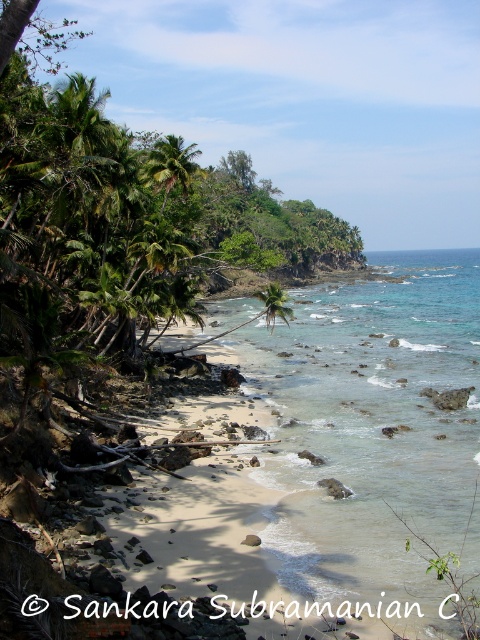
Is green leafy palm tree at upper left in front of green leafy palm tree at center?

Yes, green leafy palm tree at upper left is closer to the viewer.

Between point (168, 179) and point (267, 326), which one is positioned behind?

Point (267, 326)

I want to click on green leafy palm tree at upper left, so click(x=170, y=164).

Between clear water at beach center and green leafy palm tree at upper left, which one appears on the right side from the viewer's perspective?

clear water at beach center

Find the location of a particular element. The height and width of the screenshot is (640, 480). clear water at beach center is located at coordinates (374, 424).

Locate an element on the screen. This screenshot has height=640, width=480. clear water at beach center is located at coordinates (374, 424).

Is clear water at beach center positioned behind green leafy palm tree at center?

No, clear water at beach center is in front of green leafy palm tree at center.

Can you confirm if clear water at beach center is bigger than green leafy palm tree at center?

Yes.

This screenshot has width=480, height=640. What are the coordinates of `clear water at beach center` in the screenshot? It's located at (374, 424).

Where is `clear water at beach center`? Image resolution: width=480 pixels, height=640 pixels. clear water at beach center is located at coordinates (374, 424).